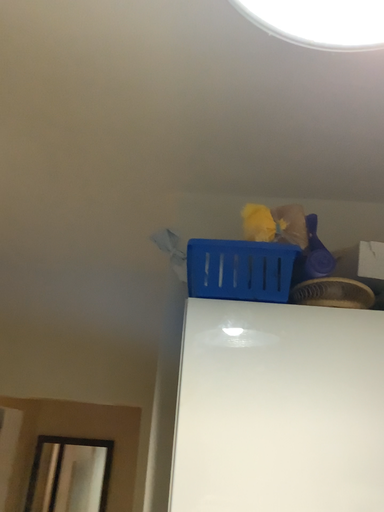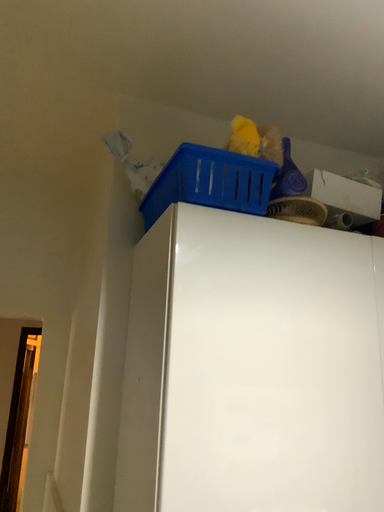
Question: Which way did the camera rotate in the video?

Choices:
 (A) rotated upward
 (B) rotated downward

Answer: (B)